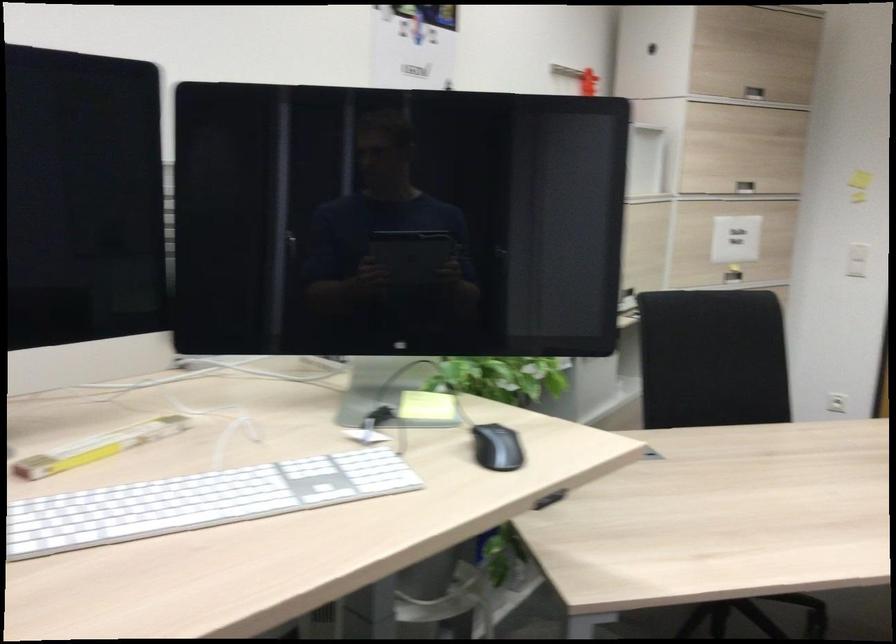
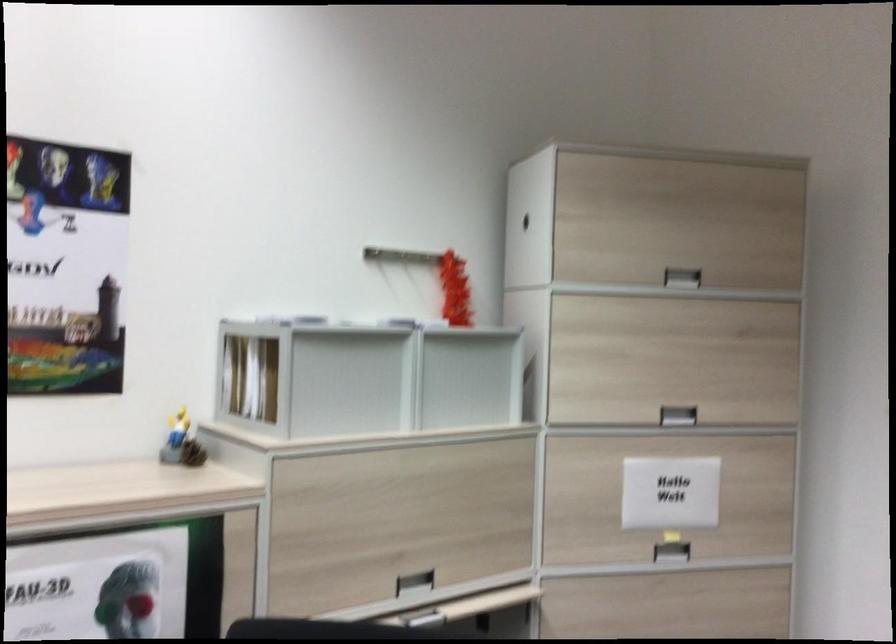
Find the pixel in the second image that matches point (760, 91) in the first image.

(682, 277)